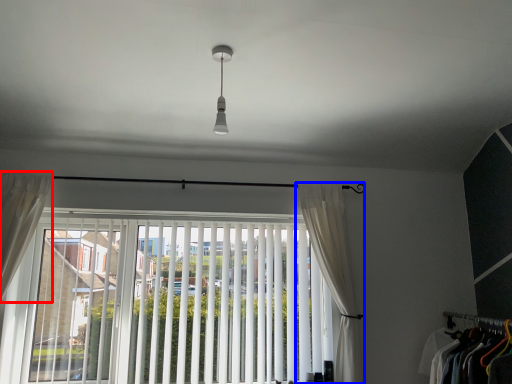
Question: Which of the following is the closest to the observer, curtain (highlighted by a red box) or curtain (highlighted by a blue box)?

Choices:
 (A) curtain
 (B) curtain

Answer: (A)